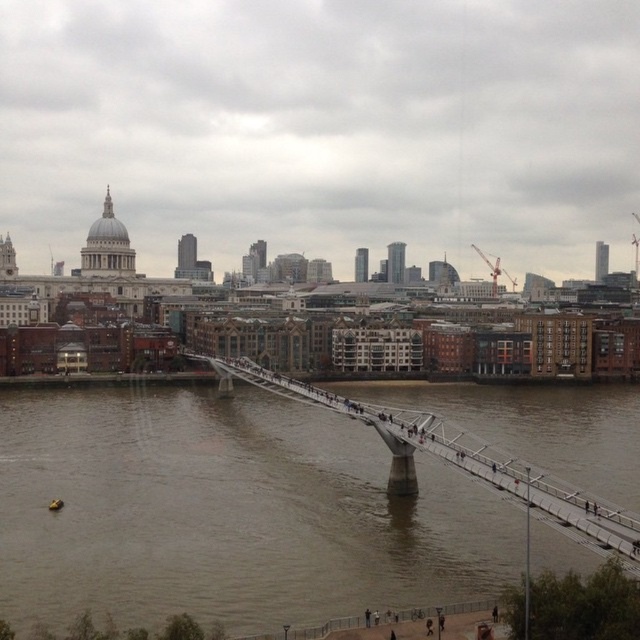
Image resolution: width=640 pixels, height=640 pixels. I want to click on brown muddy water at center, so click(x=228, y=513).

Between point (129, 538) and point (400, 492), which one is positioned behind?

The point (400, 492) is behind.

Find the location of a particular element. Image resolution: width=640 pixels, height=640 pixels. brown muddy water at center is located at coordinates (228, 513).